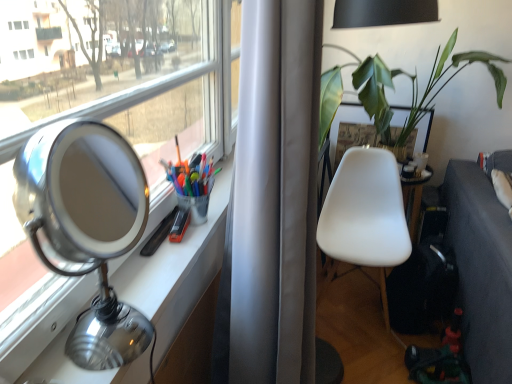
Question: Can you confirm if white matte chair at center is shorter than dark gray fabric couch at lower right?

Choices:
 (A) yes
 (B) no

Answer: (B)

Question: Can you confirm if white matte chair at center is positioned to the right of dark gray fabric couch at lower right?

Choices:
 (A) yes
 (B) no

Answer: (B)

Question: Considering the relative sizes of white matte chair at center and dark gray fabric couch at lower right in the image provided, is white matte chair at center bigger than dark gray fabric couch at lower right?

Choices:
 (A) yes
 (B) no

Answer: (B)

Question: Is white matte chair at center looking in the opposite direction of dark gray fabric couch at lower right?

Choices:
 (A) yes
 (B) no

Answer: (B)

Question: From the image's perspective, is white matte chair at center over dark gray fabric couch at lower right?

Choices:
 (A) yes
 (B) no

Answer: (A)

Question: Is white matte chair at center outside dark gray fabric couch at lower right?

Choices:
 (A) no
 (B) yes

Answer: (B)

Question: Can you confirm if dark gray fabric couch at lower right is positioned to the right of green leafy plant at upper right?

Choices:
 (A) yes
 (B) no

Answer: (A)

Question: From a real-world perspective, does dark gray fabric couch at lower right sit lower than green leafy plant at upper right?

Choices:
 (A) no
 (B) yes

Answer: (B)

Question: Can you confirm if dark gray fabric couch at lower right is shorter than green leafy plant at upper right?

Choices:
 (A) yes
 (B) no

Answer: (B)

Question: From a real-world perspective, does dark gray fabric couch at lower right stand above green leafy plant at upper right?

Choices:
 (A) no
 (B) yes

Answer: (A)

Question: Does dark gray fabric couch at lower right have a lesser width compared to green leafy plant at upper right?

Choices:
 (A) yes
 (B) no

Answer: (A)

Question: Can you see dark gray fabric couch at lower right touching green leafy plant at upper right?

Choices:
 (A) no
 (B) yes

Answer: (A)

Question: Is green leafy plant at upper right closer to the viewer compared to dark gray fabric couch at lower right?

Choices:
 (A) yes
 (B) no

Answer: (B)